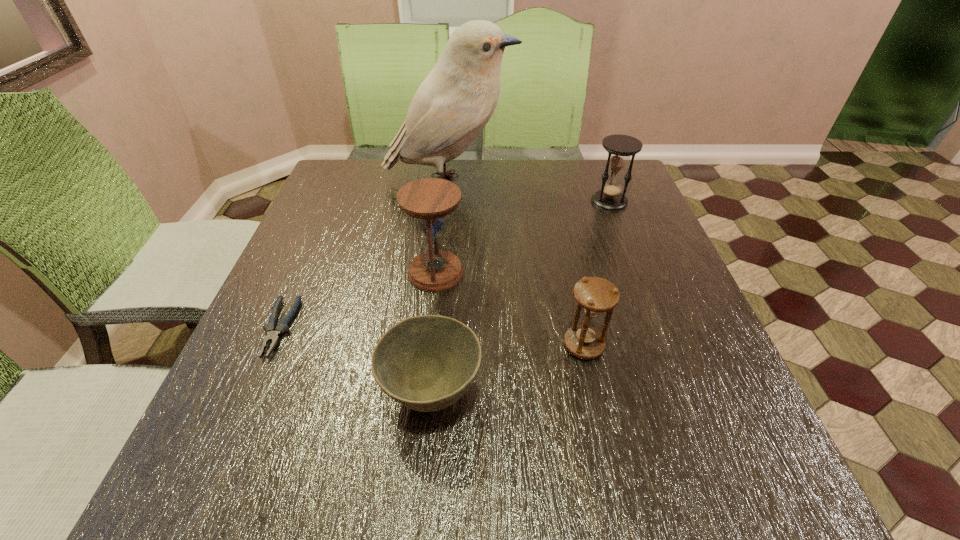
Identify the location of vacant region located 0.090m on the face of the tallest object. Image resolution: width=960 pixels, height=540 pixels. pyautogui.click(x=545, y=182).

Locate an element on the screen. Image resolution: width=960 pixels, height=540 pixels. vacant region located 0.360m on the front of the third farthest object is located at coordinates (417, 454).

The height and width of the screenshot is (540, 960). I want to click on vacant region located 0.110m on the back of the rightmost hourglass, so click(x=598, y=172).

Identify the location of free space located on the right of the nearest hourglass. The width and height of the screenshot is (960, 540). coord(692,345).

Where is `vacant position located 0.240m on the back of the bowl`? This screenshot has width=960, height=540. vacant position located 0.240m on the back of the bowl is located at coordinates (444, 268).

Image resolution: width=960 pixels, height=540 pixels. I want to click on vacant space located 0.230m at the gripping part of the pliers, so click(x=210, y=487).

This screenshot has height=540, width=960. In order to click on parakeet located at the far edge in this screenshot , I will do `click(456, 100)`.

The width and height of the screenshot is (960, 540). What are the coordinates of `hourglass that is at the far edge` in the screenshot? It's located at (620, 147).

Locate an element on the screen. The image size is (960, 540). object located in the left edge section of the desktop is located at coordinates (273, 332).

Find the location of a particular element. object located at the right edge is located at coordinates (620, 147).